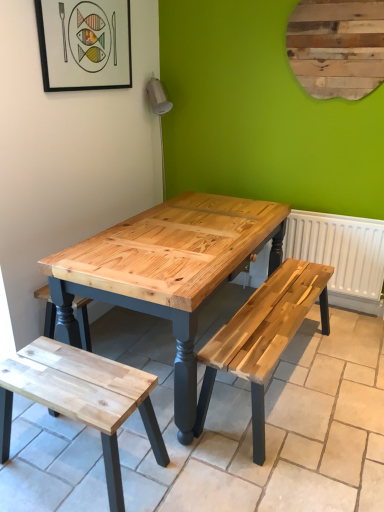
Question: From the image's perspective, is white matte radiator at right located beneath natural wood bench at lower left?

Choices:
 (A) no
 (B) yes

Answer: (A)

Question: Can you confirm if white matte radiator at right is taller than natural wood bench at lower left?

Choices:
 (A) yes
 (B) no

Answer: (A)

Question: Does white matte radiator at right have a greater width compared to natural wood bench at lower left?

Choices:
 (A) no
 (B) yes

Answer: (A)

Question: Does white matte radiator at right have a lesser width compared to natural wood bench at lower left?

Choices:
 (A) yes
 (B) no

Answer: (A)

Question: From a real-world perspective, is white matte radiator at right positioned under natural wood bench at lower left based on gravity?

Choices:
 (A) yes
 (B) no

Answer: (B)

Question: Is white matte radiator at right oriented away from natural wood bench at lower left?

Choices:
 (A) no
 (B) yes

Answer: (A)

Question: Would you consider matte black picture frame at upper left to be distant from white matte radiator at right?

Choices:
 (A) yes
 (B) no

Answer: (A)

Question: From a real-world perspective, is matte black picture frame at upper left positioned under white matte radiator at right based on gravity?

Choices:
 (A) yes
 (B) no

Answer: (B)

Question: Does matte black picture frame at upper left have a larger size compared to white matte radiator at right?

Choices:
 (A) no
 (B) yes

Answer: (A)

Question: Does matte black picture frame at upper left turn towards white matte radiator at right?

Choices:
 (A) yes
 (B) no

Answer: (B)

Question: Is matte black picture frame at upper left to the left of white matte radiator at right from the viewer's perspective?

Choices:
 (A) yes
 (B) no

Answer: (A)

Question: Is matte black picture frame at upper left turned away from white matte radiator at right?

Choices:
 (A) no
 (B) yes

Answer: (A)

Question: Is natural wood bench at lower left in contact with matte black picture frame at upper left?

Choices:
 (A) no
 (B) yes

Answer: (A)